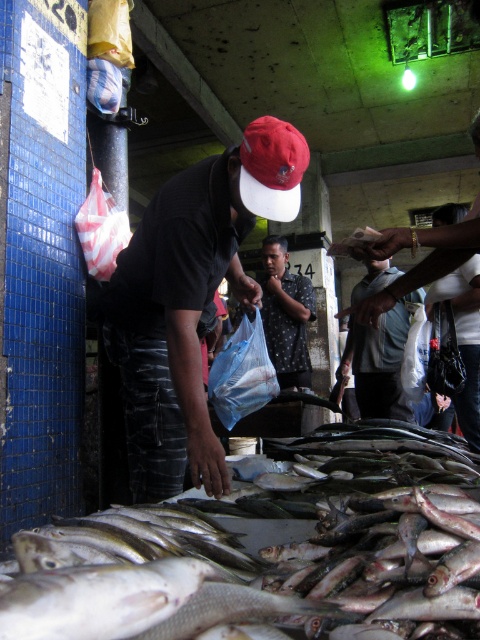
You are a customer at the fish market and want to pick up the shiny silver fish at lower center. However, there is a person wearing the matte black shirt at center in front of you. Can you reach the fish without moving the person?

The shiny silver fish at lower center is located below the matte black shirt at center, so you can reach it without moving the person by bending down or reaching around them.

You are a customer at the fish market and want to pick up the shiny silver fish at lower center. However, there is a person wearing the light blue fabric shirt at center in front of you. Can you reach the fish without moving the person?

The shiny silver fish at lower center is closer to the viewer than the light blue fabric shirt at center, so you can reach the fish without moving the person because it is in front of them.